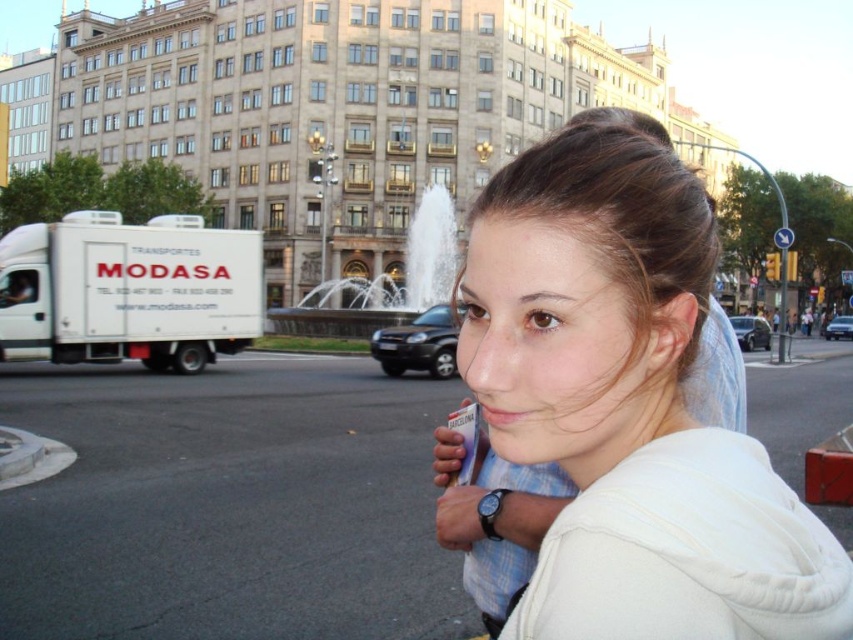
Can you confirm if white cotton hoodie at center is positioned to the right of brown smooth hair at center?

In fact, white cotton hoodie at center is to the left of brown smooth hair at center.

Can you confirm if white cotton hoodie at center is positioned above brown smooth hair at center?

Actually, white cotton hoodie at center is below brown smooth hair at center.

Where is `white cotton hoodie at center`? white cotton hoodie at center is located at coordinates (630, 406).

This screenshot has width=853, height=640. I want to click on white cotton hoodie at center, so click(x=630, y=406).